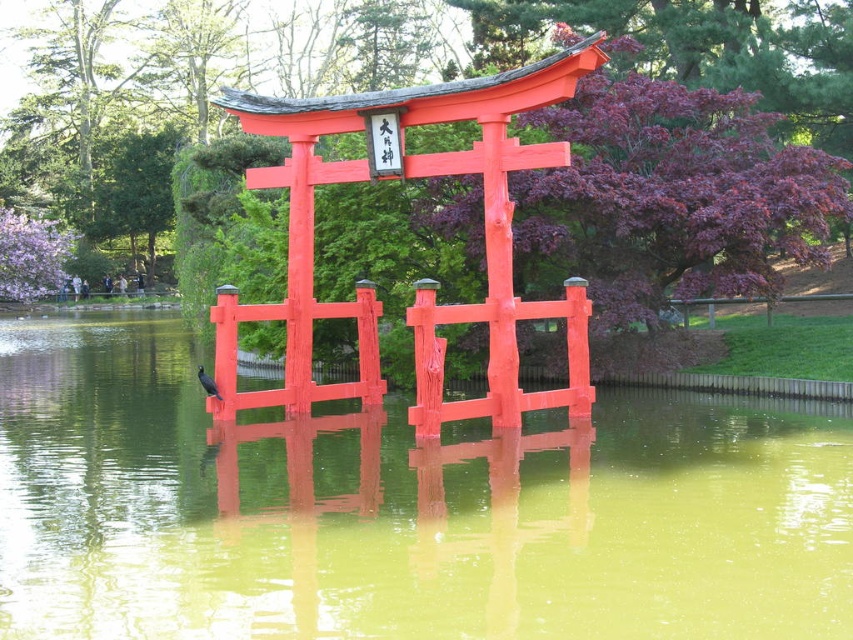
Who is lower down, greenish water at center or shiny black bird at center?

greenish water at center

Identify the location of greenish water at center. The height and width of the screenshot is (640, 853). (402, 509).

Where is `greenish water at center`? The height and width of the screenshot is (640, 853). greenish water at center is located at coordinates (402, 509).

The image size is (853, 640). In order to click on greenish water at center in this screenshot , I will do `click(402, 509)`.

Which is in front, point (276, 104) or point (210, 381)?

Positioned in front is point (210, 381).

Does point (317, 401) come closer to viewer compared to point (218, 396)?

No, (317, 401) is behind (218, 396).

Describe the element at coordinates (421, 278) in the screenshot. I see `smooth glossy red shrine at center` at that location.

The height and width of the screenshot is (640, 853). Find the location of `smooth glossy red shrine at center`. smooth glossy red shrine at center is located at coordinates (421, 278).

Between greenish water at center and smooth glossy red shrine at center, which one appears on the left side from the viewer's perspective?

smooth glossy red shrine at center is more to the left.

Who is shorter, greenish water at center or smooth glossy red shrine at center?

With less height is greenish water at center.

Identify the location of greenish water at center. The height and width of the screenshot is (640, 853). (402, 509).